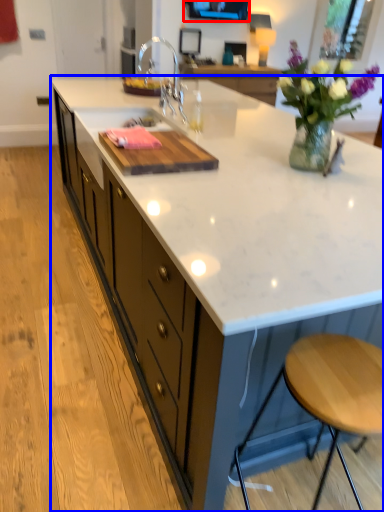
Question: Which point is closer to the camera, window screen (highlighted by a red box) or countertop (highlighted by a blue box)?

Choices:
 (A) window screen
 (B) countertop

Answer: (B)